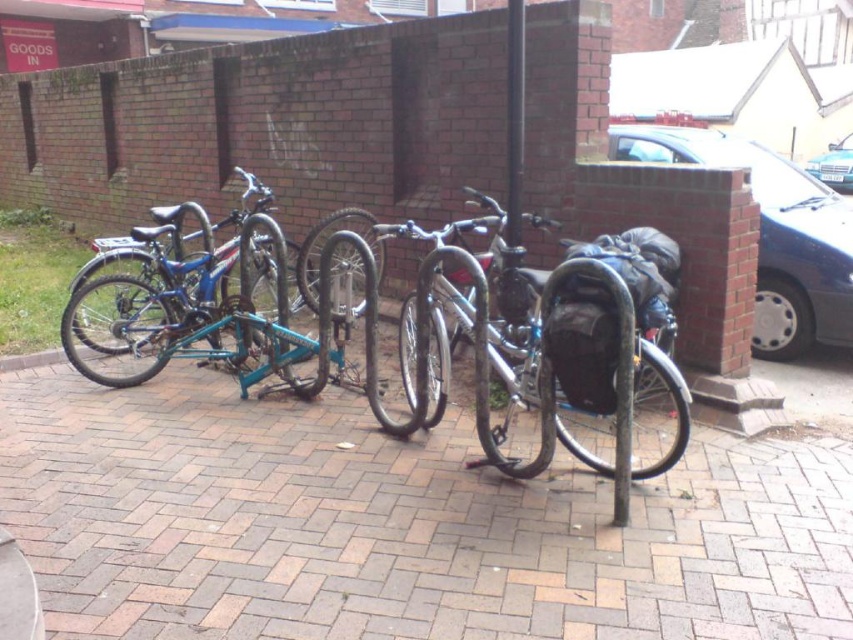
Question: Which point is farther to the camera?

Choices:
 (A) (816, 449)
 (B) (515, 236)
 (C) (90, 243)

Answer: (C)

Question: Which of the following is the closest to the observer?

Choices:
 (A) pos(122,570)
 (B) pos(811,182)

Answer: (A)

Question: Is blue metallic bicycle at left positioned before black metal pole at center?

Choices:
 (A) no
 (B) yes

Answer: (A)

Question: Does shiny metallic bicycle at center appear under black metal pole at center?

Choices:
 (A) yes
 (B) no

Answer: (A)

Question: Observing the image, what is the correct spatial positioning of shiny metallic bicycle at center in reference to metallic blue car at right?

Choices:
 (A) above
 (B) below

Answer: (B)

Question: Considering the real-world distances, which object is closest to the brick pavement at center?

Choices:
 (A) black metal pole at center
 (B) metallic blue car at right
 (C) metallic blue car at upper right
 (D) shiny metallic bicycle at center

Answer: (D)